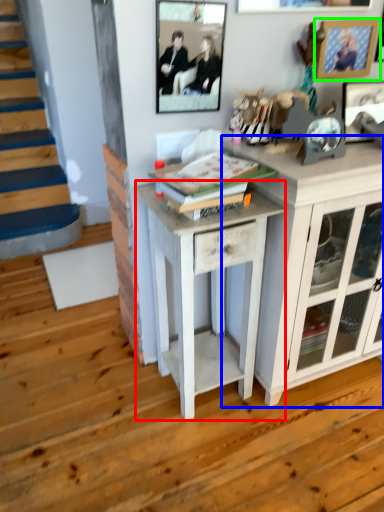
Question: Considering the real-world distances, which object is closest to table (highlighted by a red box)? cabinetry (highlighted by a blue box) or picture frame (highlighted by a green box).

Choices:
 (A) cabinetry
 (B) picture frame

Answer: (A)